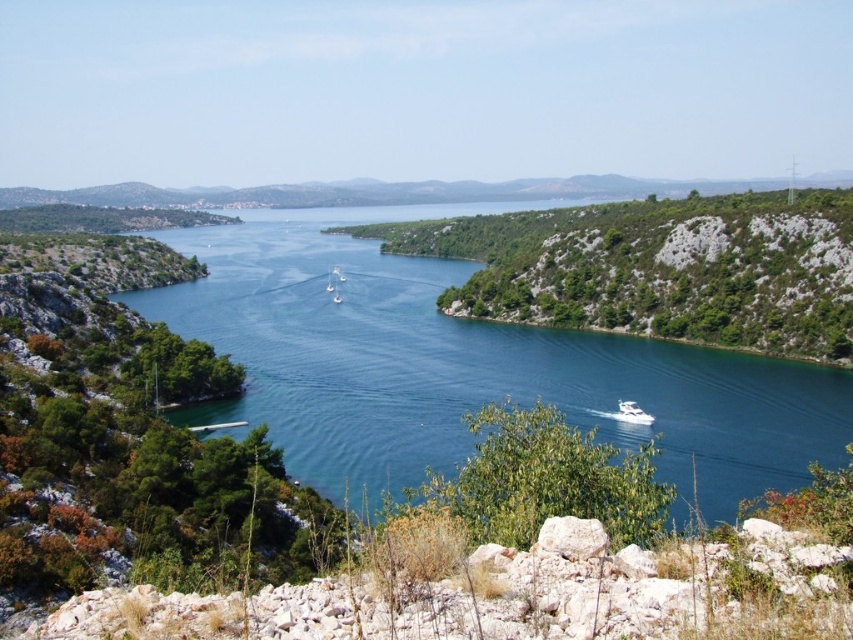
Question: Which object appears closest to the camera in this image?

Choices:
 (A) green leafy hillside at center
 (B) white glossy boat at lower right
 (C) clear blue water at center

Answer: (C)

Question: Which of the following is the closest to the observer?

Choices:
 (A) white glossy boat at lower right
 (B) clear blue water at center
 (C) green leafy hillside at center

Answer: (B)

Question: Considering the real-world distances, which object is farthest from the white glossy boat at lower right?

Choices:
 (A) clear blue water at center
 (B) green leafy hillside at center

Answer: (B)

Question: Where is clear blue water at center located in relation to green leafy hillside at center in the image?

Choices:
 (A) below
 (B) above

Answer: (A)

Question: Where is clear blue water at center located in relation to white glossy boat at lower right in the image?

Choices:
 (A) above
 (B) below

Answer: (A)

Question: Is clear blue water at center further to camera compared to green leafy hillside at center?

Choices:
 (A) yes
 (B) no

Answer: (B)